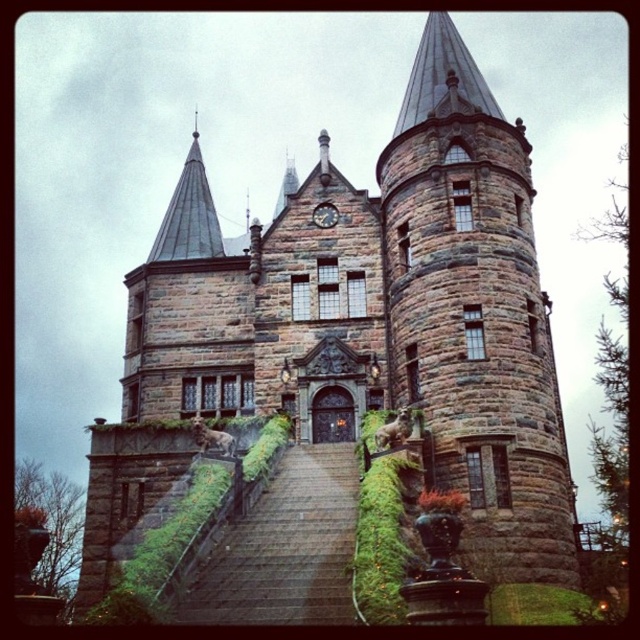
Question: Is brown stone tower at center wider than stone stairs at center?

Choices:
 (A) no
 (B) yes

Answer: (B)

Question: Can you confirm if brown stone tower at center is positioned to the left of stone stairs at center?

Choices:
 (A) no
 (B) yes

Answer: (A)

Question: Which point is closer to the camera?

Choices:
 (A) brown stone tower at center
 (B) stone stairs at center

Answer: (B)

Question: Does brown stone tower at center appear on the right side of stone stairs at center?

Choices:
 (A) yes
 (B) no

Answer: (A)